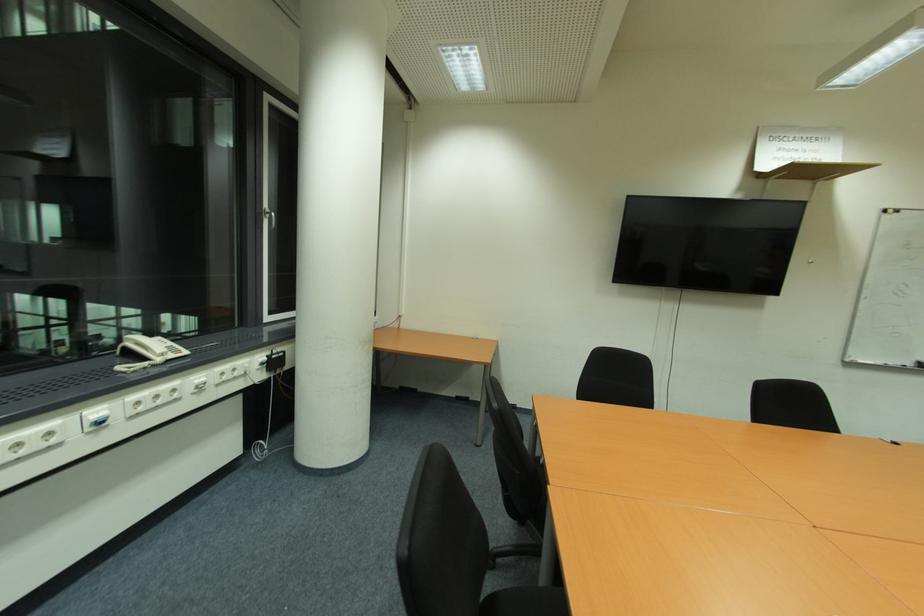
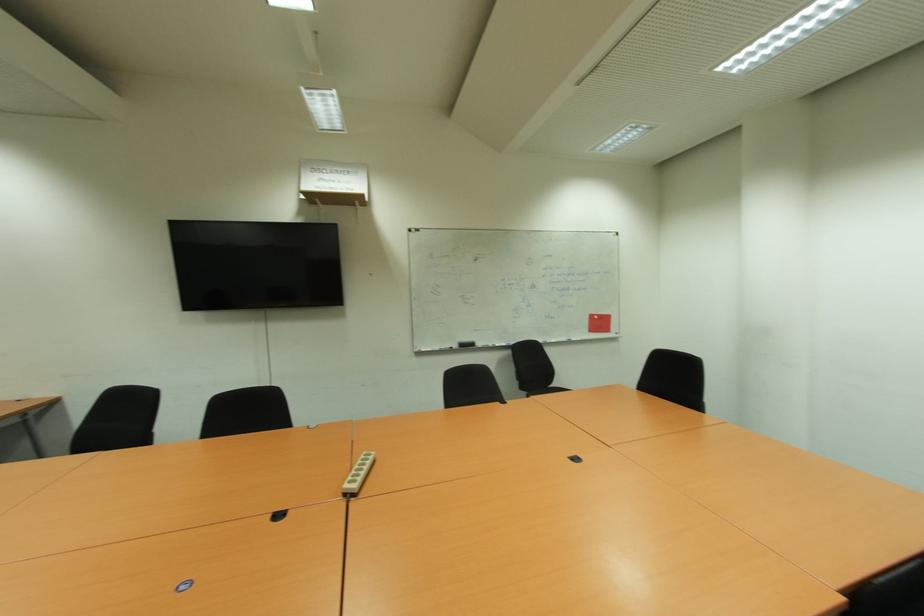
Question: The images are taken continuously from a first-person perspective. In which direction are you moving?

Choices:
 (A) Left
 (B) Right
 (C) Forward
 (D) Backward

Answer: (B)